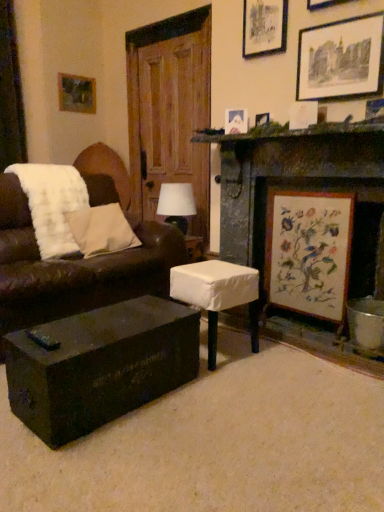
Locate an element on the screen. The height and width of the screenshot is (512, 384). free location in front of matte black trunk at lower center is located at coordinates (114, 465).